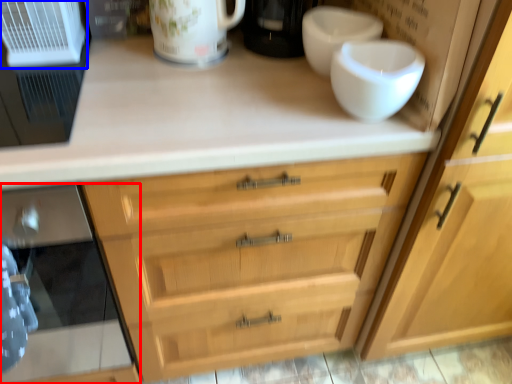
Question: Among these objects, which one is nearest to the camera, oven (highlighted by a red box) or appliance (highlighted by a blue box)?

Choices:
 (A) oven
 (B) appliance

Answer: (A)